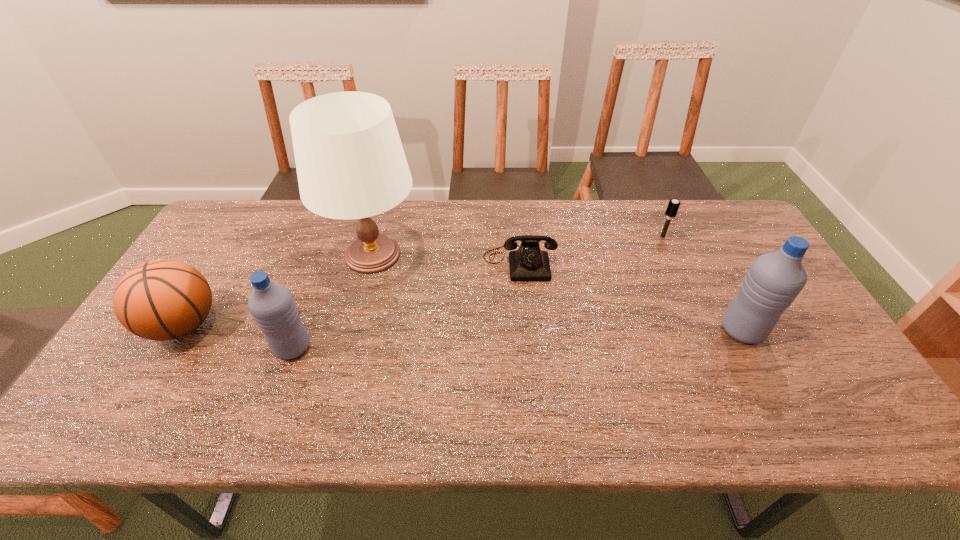
Find the location of `free location that satisfies the following two spatial constraints: 1. on the back side of the third tallest object; 2. on the right side of the tallest object`. free location that satisfies the following two spatial constraints: 1. on the back side of the third tallest object; 2. on the right side of the tallest object is located at coordinates (326, 255).